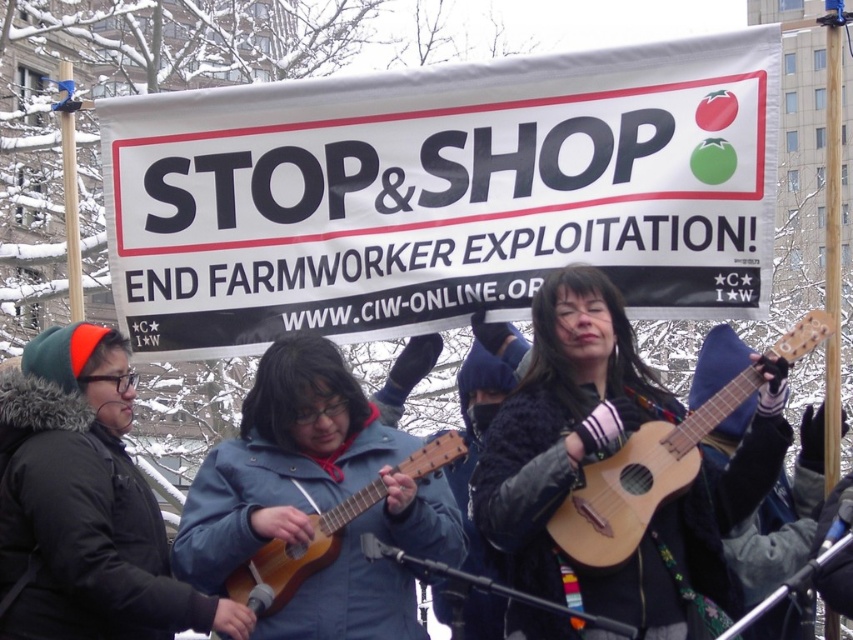
You are a photographer at the protest scene. You want to capture a closeup shot of the light brown wooden guitar at center and the wooden acoustic guitar at center. Which guitar should you focus on first if you want to ensure both are in focus without moving the camera?

The light brown wooden guitar at center is positioned over the wooden acoustic guitar at center, so focusing on the light brown wooden guitar at center first will ensure both are in focus since it is closer to the camera.

You are a photographer trying to capture a closeup of both the light brown wooden guitar at center and the wooden acoustic guitar at center. Which guitar should you focus on first if you want to ensure both are in frame without moving the camera?

The light brown wooden guitar at center might be wider than wooden acoustic guitar at center, so focusing on the wider one first would help ensure both fit in the frame.